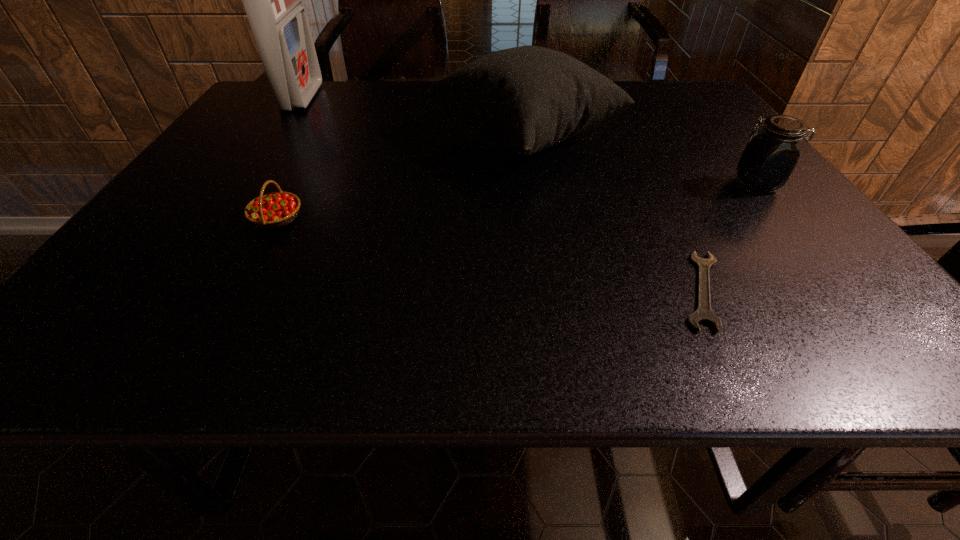
Where is `object that is positioned at the right edge`? This screenshot has height=540, width=960. object that is positioned at the right edge is located at coordinates (770, 156).

Locate an element on the screen. Image resolution: width=960 pixels, height=540 pixels. object that is at the far left corner is located at coordinates (272, 0).

This screenshot has height=540, width=960. What are the coordinates of `vacant space at the far edge of the desktop` in the screenshot? It's located at (418, 104).

Identify the location of vacant region at the near edge. The image size is (960, 540). (344, 337).

At what (x,y) coordinates should I click in order to perform the action: click on free spot at the left edge of the desktop. Please return your answer as a coordinate pair (x, y). Looking at the image, I should click on (225, 176).

Where is `vacant space at the right edge`? The image size is (960, 540). vacant space at the right edge is located at coordinates (707, 141).

Locate an element on the screen. vacant space at the far left corner of the desktop is located at coordinates (270, 114).

Locate an element on the screen. This screenshot has height=540, width=960. vacant space at the far right corner of the desktop is located at coordinates (660, 112).

This screenshot has height=540, width=960. In order to click on vacant space in between the rightmost object and the fourth shortest object in this screenshot , I will do `click(640, 160)`.

Locate an element on the screen. The width and height of the screenshot is (960, 540). vacant area between the rightmost object and the second tallest object is located at coordinates (640, 160).